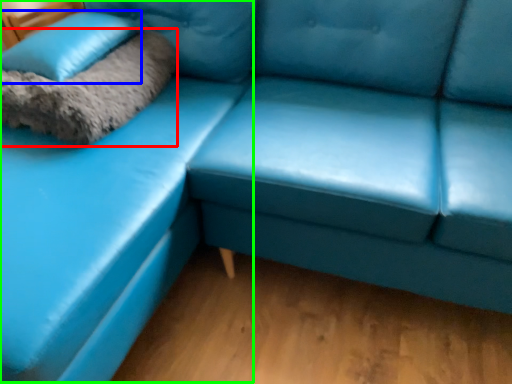
Question: Based on their relative distances, which object is farther from blanket (highlighted by a red box)? Choose from pillow (highlighted by a blue box) and couch (highlighted by a green box).

Choices:
 (A) pillow
 (B) couch

Answer: (B)